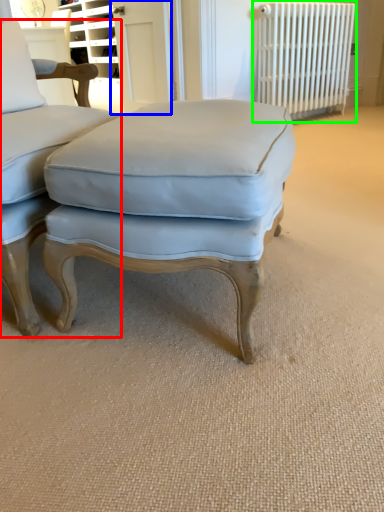
Question: Which object is the farthest from chair (highlighted by a red box)? Choose among these: screen door (highlighted by a blue box) or radiator (highlighted by a green box).

Choices:
 (A) screen door
 (B) radiator

Answer: (B)